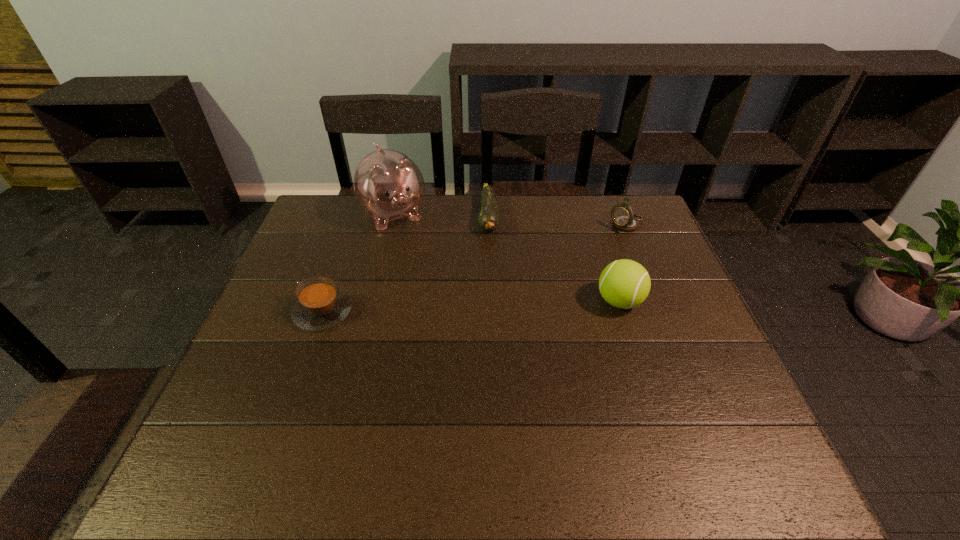
Identify which object is the third closest to the compass. Please provide its 2D coordinates. Your answer should be formatted as a tuple, i.e. [(x, y)], where the tuple contains the x and y coordinates of a point satisfying the conditions above.

[(389, 186)]